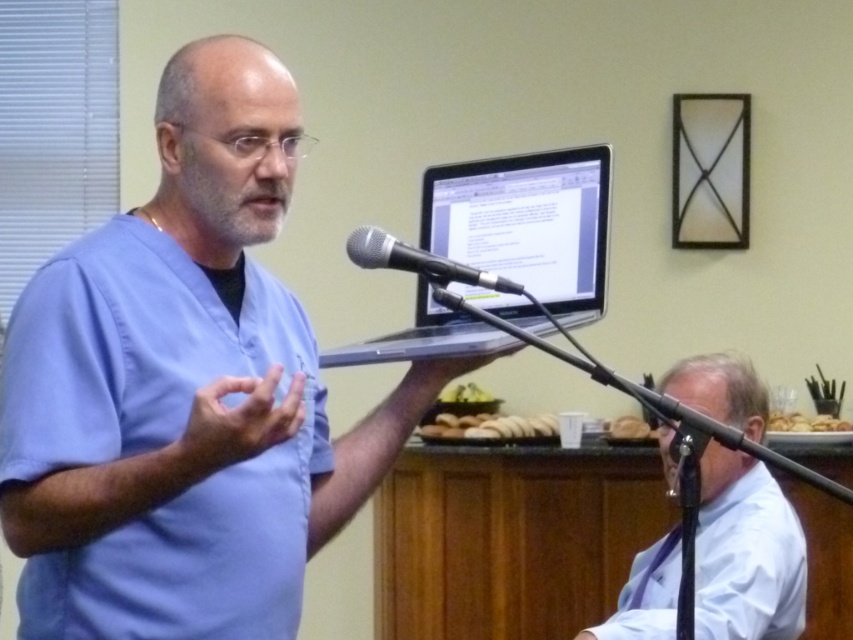
You are taking a photo of the scene and want to focus on both point (456, 432) and point (471, 396). Which point should you adjust your focus to first to ensure both are in sharp view?

Point (456, 432) is closer to the camera than point (471, 396). To ensure both are in sharp focus, adjust the focus starting from the closer point (456, 432) first.

You are a person attending a presentation given by a man in a light blue scrub top. You want to grab the golden brown croissant at center during the presentation. Where should you look to find it?

The golden brown croissant at center is located at point 0.667 on the x axis and 0.576 on the y axis.

In the scene shown: You are standing in the room where the presentation is happening. You need to hand the presenter a pen that is on the table next to you. The pen is at the same level as the white glossy shirt at lower right. Can you reach the pen without moving from your current position?

The white glossy shirt at lower right and viewer are 6.13 feet apart from each other. Since the pen is at the same level as the white glossy shirt at lower right, and assuming the viewer can reach about 2 feet, the distance is too far to reach the pen without moving.